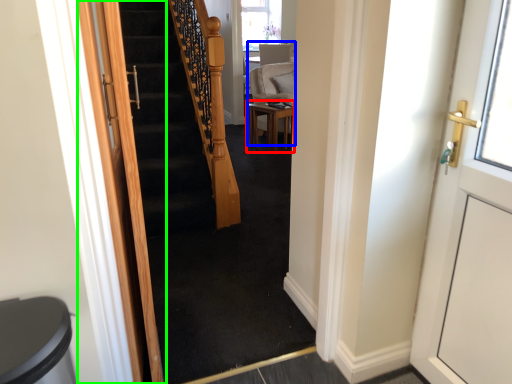
Question: Estimate the real-world distances between objects in this image. Which object is farther from table (highlighted by a red box), armchair (highlighted by a blue box) or door (highlighted by a green box)?

Choices:
 (A) armchair
 (B) door

Answer: (B)